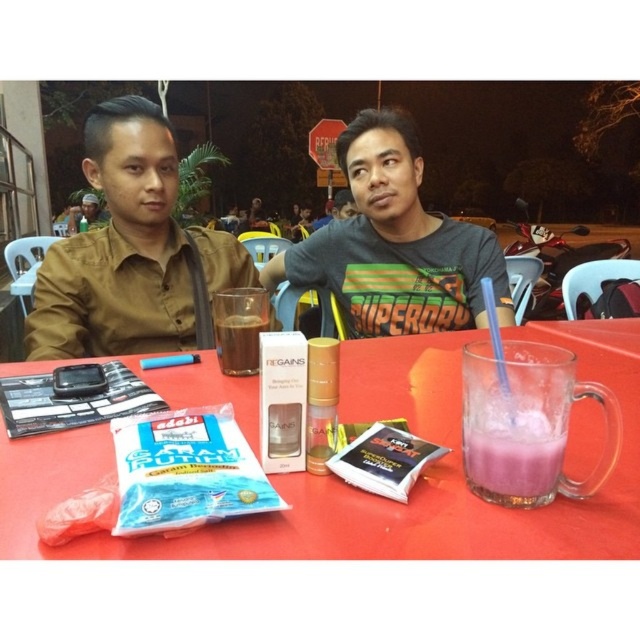
Between gray cotton t-shirt at center and purple translucent glass at lower right, which one appears on the left side from the viewer's perspective?

gray cotton t-shirt at center

Consider the image. Who is lower down, gray cotton t-shirt at center or purple translucent glass at lower right?

purple translucent glass at lower right is below.

Who is more distant from viewer, (412, 164) or (468, 422)?

The point (412, 164) is behind.

Find the location of a particular element. gray cotton t-shirt at center is located at coordinates (394, 243).

Looking at this image, does transparent plastic table at center have a greater height compared to translucent glass cup at center?

Indeed, transparent plastic table at center has a greater height compared to translucent glass cup at center.

Describe the element at coordinates (362, 492) in the screenshot. This screenshot has height=640, width=640. I see `transparent plastic table at center` at that location.

Who is more forward, (467, 515) or (252, 358)?

Point (467, 515)

At what (x,y) coordinates should I click in order to perform the action: click on transparent plastic table at center. Please return your answer as a coordinate pair (x, y). Looking at the image, I should click on (362, 492).

Looking at this image, is purple translucent glass at lower right to the left of matte black shirt at left from the viewer's perspective?

In fact, purple translucent glass at lower right is to the right of matte black shirt at left.

How much distance is there between purple translucent glass at lower right and matte black shirt at left?

They are 5.24 meters apart.

Is point (547, 483) positioned after point (70, 225)?

No, (547, 483) is in front of (70, 225).

You are a GUI agent. You are given a task and a screenshot of the screen. Output one action in this format:
    pyautogui.click(x=<x>, y=<y>)
    Task: Click on the purple translucent glass at lower right
    This screenshot has height=640, width=640.
    Given the screenshot: What is the action you would take?
    pos(513,456)